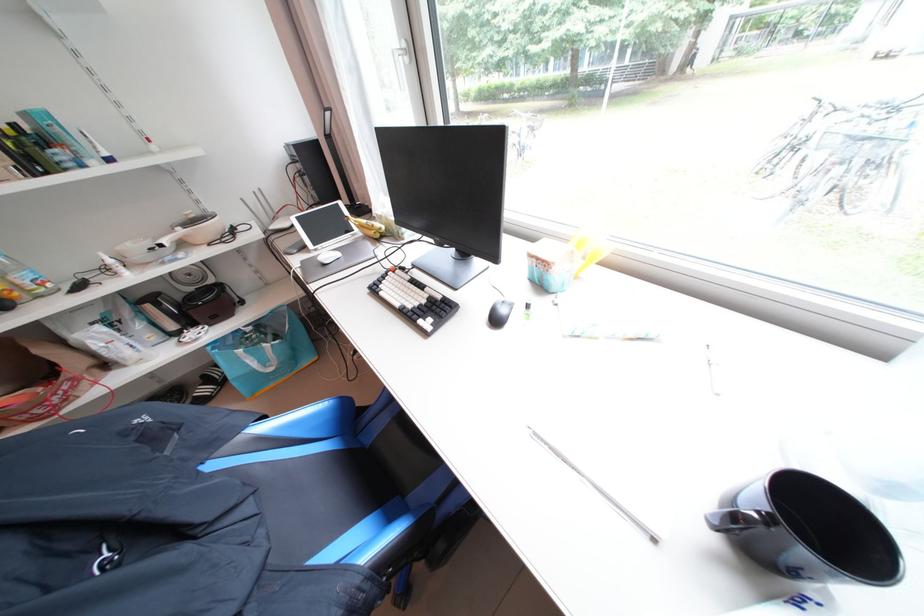
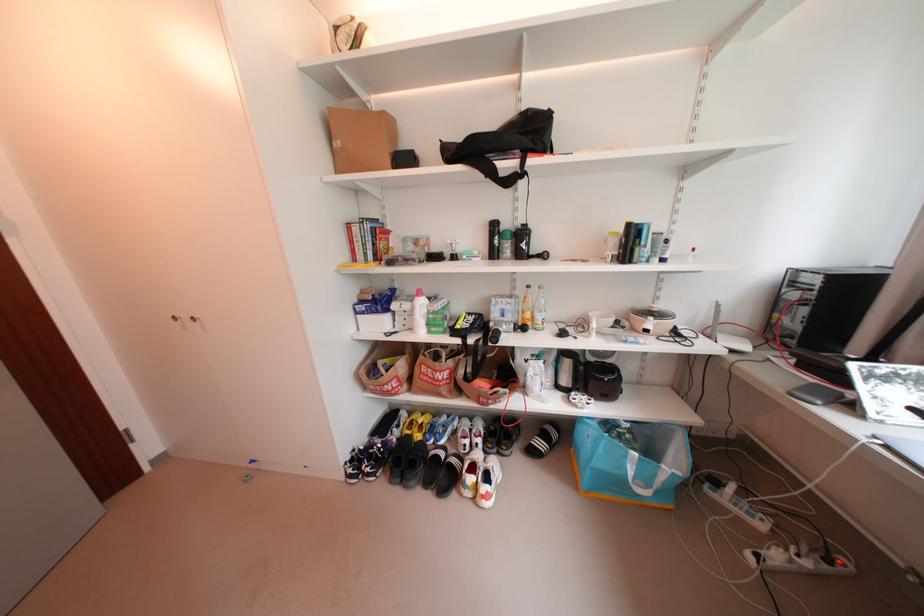
Where in the second image is the point corresponding to the point at 213,381 from the first image?

(553, 437)